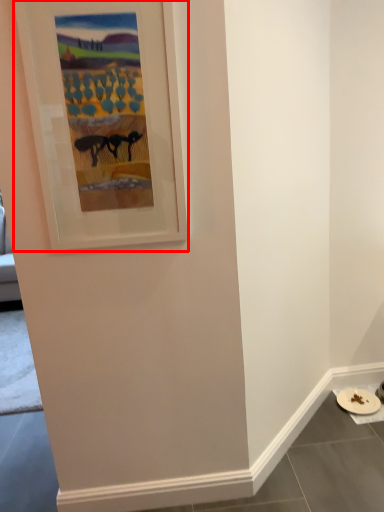
Question: Considering the relative positions of picture frame (annotated by the red box) and platter in the image provided, where is picture frame (annotated by the red box) located with respect to the staircase?

Choices:
 (A) left
 (B) right

Answer: (A)